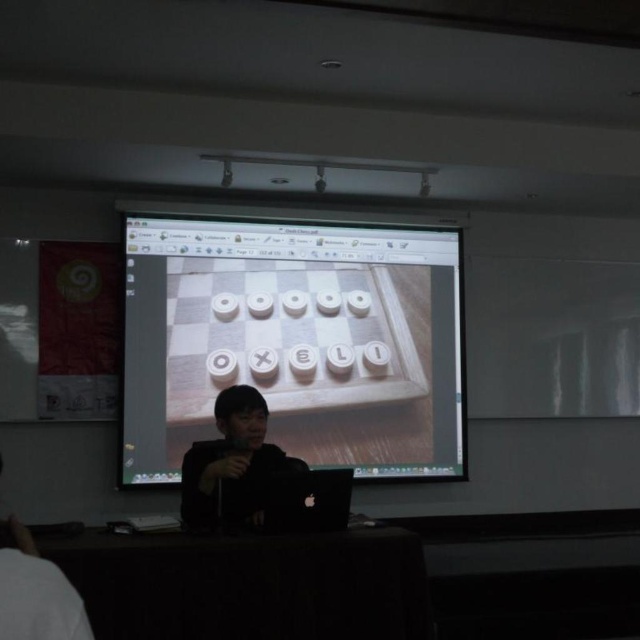
How much distance is there between wooden board at center and black matte shirt at center?

They are 1.31 meters apart.

Between point (449, 228) and point (184, 483), which one is positioned in front?

Point (184, 483) is in front.

Is point (458, 282) positioned behind point (220, 426)?

Yes, it is.

The width and height of the screenshot is (640, 640). Find the location of `wooden board at center`. wooden board at center is located at coordinates (294, 340).